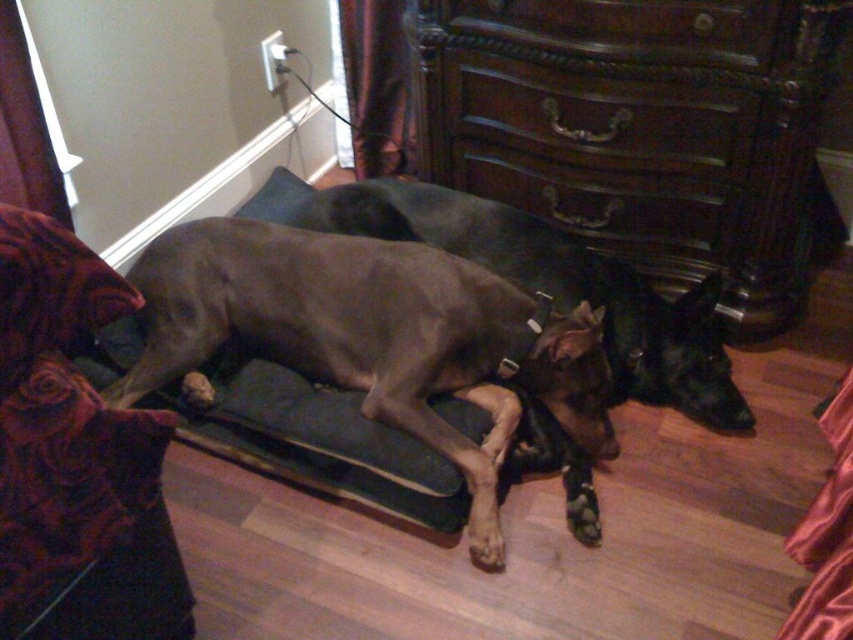
Question: In this image, where is dark wood dresser at center located relative to smooth gray dog at center?

Choices:
 (A) above
 (B) below

Answer: (A)

Question: Is the position of dark wood dresser at center more distant than that of smooth gray dog at center?

Choices:
 (A) no
 (B) yes

Answer: (A)

Question: Among these points, which one is farthest from the camera?

Choices:
 (A) (548, 1)
 (B) (299, 340)

Answer: (B)

Question: Which of the following is the closest to the observer?

Choices:
 (A) dark wood dresser at center
 (B) smooth gray dog at center

Answer: (A)

Question: Which point is closer to the camera?

Choices:
 (A) (782, 236)
 (B) (380, 358)

Answer: (B)

Question: Is dark wood dresser at center positioned before smooth gray dog at center?

Choices:
 (A) yes
 (B) no

Answer: (A)